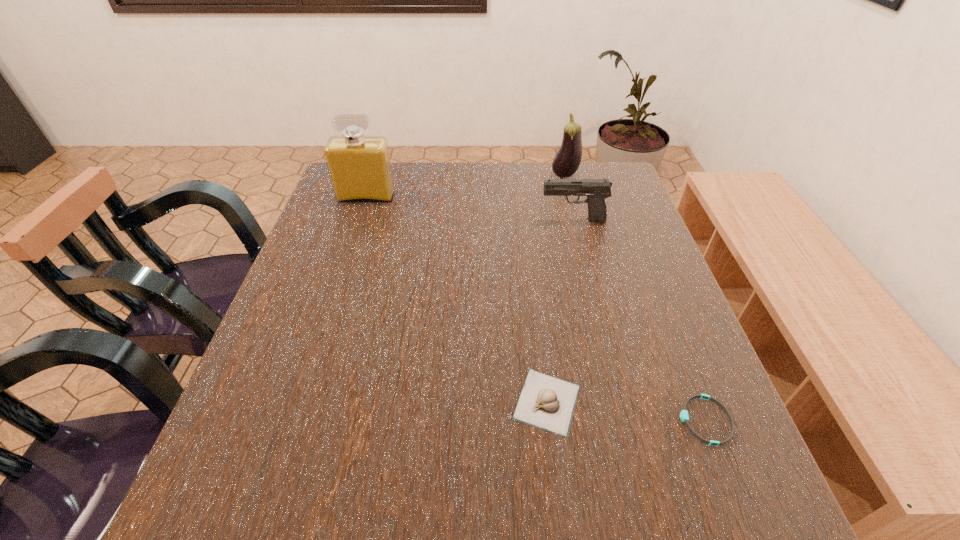
Locate an element on the screen. vacant area situated 0.350m on the front of the second tallest object is located at coordinates (587, 262).

This screenshot has width=960, height=540. Find the location of `vacant area located 0.240m aim along the barrel of the third nearest object`. vacant area located 0.240m aim along the barrel of the third nearest object is located at coordinates (450, 220).

Find the location of a particular element. vacant region located aim along the barrel of the third nearest object is located at coordinates (480, 220).

I want to click on vacant space situated 0.380m aim along the barrel of the third nearest object, so pos(397,220).

Locate an element on the screen. This screenshot has width=960, height=540. vacant area located on the right of the garlic is located at coordinates (622, 402).

You are a GUI agent. You are given a task and a screenshot of the screen. Output one action in this format:
    pyautogui.click(x=<x>, y=<y>)
    Task: Click on the blank space located on the buckle of the rightmost object
    
    Given the screenshot: What is the action you would take?
    pyautogui.click(x=611, y=421)

Locate an element on the screen. The image size is (960, 540). free region located on the buckle of the rightmost object is located at coordinates (576, 421).

Where is `vacant point located 0.280m on the buckle of the rightmost object`? The height and width of the screenshot is (540, 960). vacant point located 0.280m on the buckle of the rightmost object is located at coordinates (518, 421).

Where is `perfume that is at the far edge`? The image size is (960, 540). perfume that is at the far edge is located at coordinates (359, 167).

Find the location of `eggplant located in the far edge section of the desktop`. eggplant located in the far edge section of the desktop is located at coordinates (566, 162).